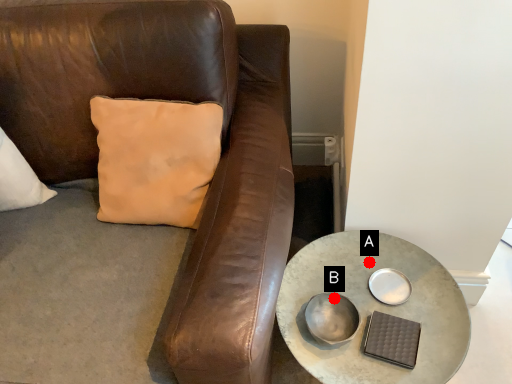
Question: Two points are circled on the image, labeled by A and B beside each circle. Among these points, which one is nearest to the camera?

Choices:
 (A) A is closer
 (B) B is closer

Answer: (B)